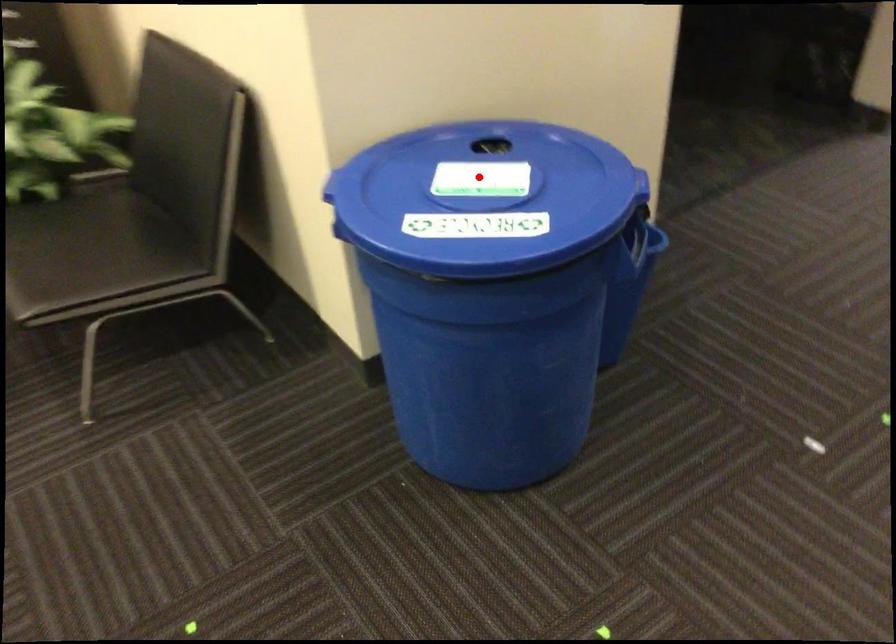
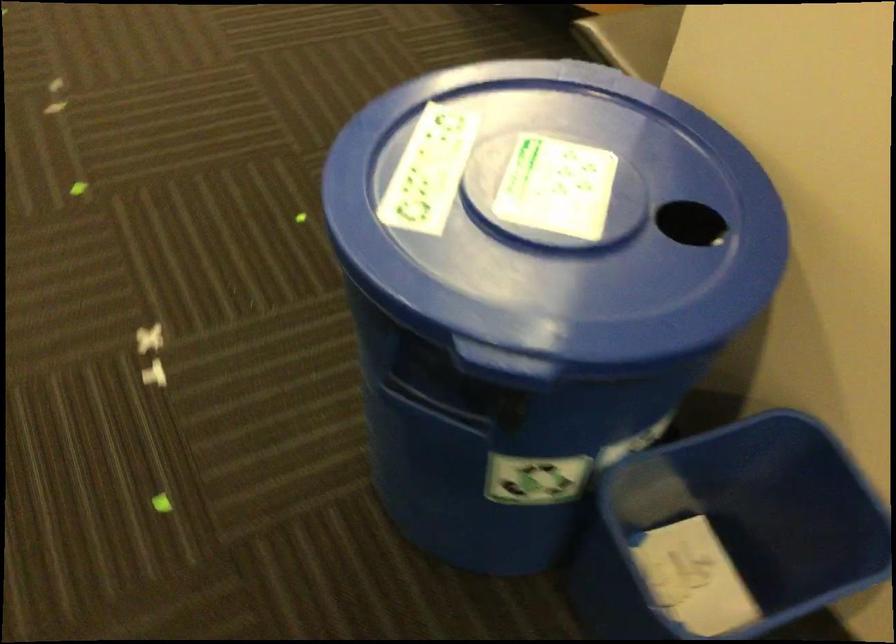
Question: I am providing you with two images of the same scene from different viewpoints. A red point is shown in image1. For the corresponding object point in image2, is it positioned nearer or farther from the camera?

Choices:
 (A) Nearer
 (B) Farther

Answer: (A)